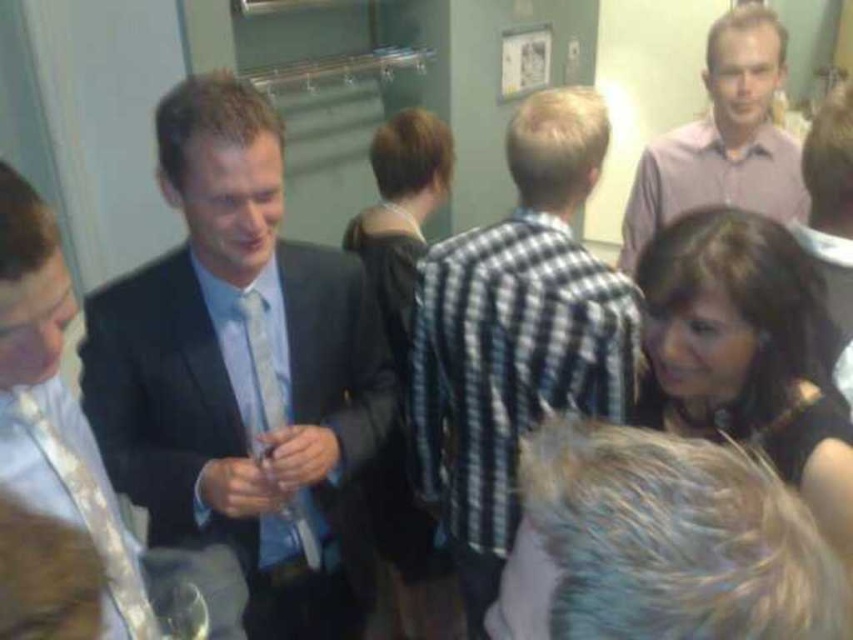
Question: Among these objects, which one is nearest to the camera?

Choices:
 (A) matte black suit at center
 (B) checkered fabric shirt at center

Answer: (A)

Question: Does checkered fabric shirt at center lie in front of pink shirt at upper right?

Choices:
 (A) yes
 (B) no

Answer: (A)

Question: Which of these objects is positioned farthest from the matte black suit at center?

Choices:
 (A) checkered fabric shirt at center
 (B) pink shirt at upper right

Answer: (B)

Question: Observing the image, what is the correct spatial positioning of matte black suit at center in reference to pink shirt at upper right?

Choices:
 (A) below
 (B) above

Answer: (A)

Question: Among these points, which one is nearest to the camera?

Choices:
 (A) (728, 33)
 (B) (173, 141)

Answer: (B)

Question: Where is checkered fabric shirt at center located in relation to pink shirt at upper right in the image?

Choices:
 (A) left
 (B) right

Answer: (A)